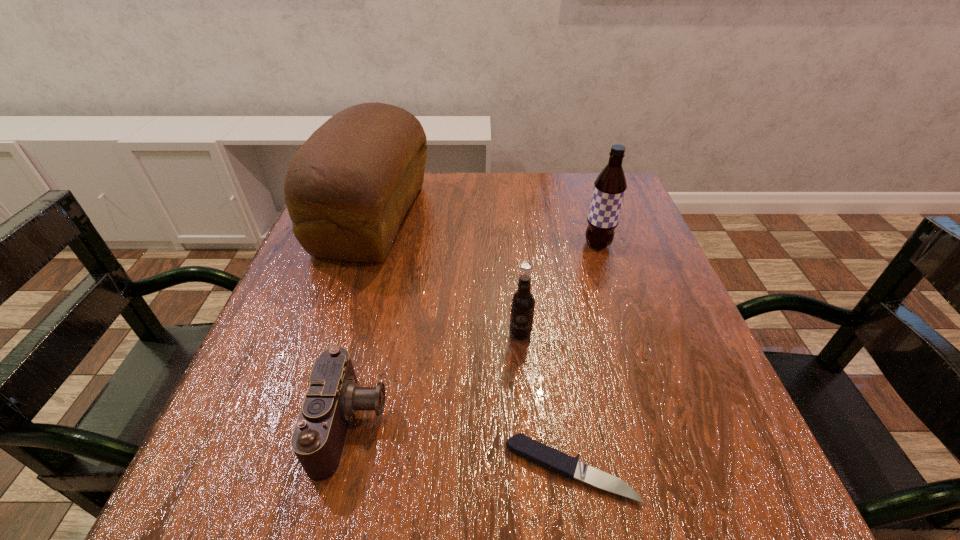
Locate an element on the screen. The height and width of the screenshot is (540, 960). vacant space at the far edge of the desktop is located at coordinates (503, 179).

You are a GUI agent. You are given a task and a screenshot of the screen. Output one action in this format:
    pyautogui.click(x=<x>, y=<y>)
    Task: Click on the free location at the left edge
    Image resolution: width=960 pixels, height=540 pixels.
    Given the screenshot: What is the action you would take?
    pyautogui.click(x=230, y=450)

The height and width of the screenshot is (540, 960). In the image, there is a desktop. In order to click on blank space at the right edge in this screenshot , I will do `click(687, 342)`.

The width and height of the screenshot is (960, 540). Find the location of `vacant space at the far right corner of the desktop`. vacant space at the far right corner of the desktop is located at coordinates (578, 209).

I want to click on vacant area at the near right corner of the desktop, so click(747, 465).

I want to click on vacant space in between the taller root beer and the steak knife, so click(584, 357).

The height and width of the screenshot is (540, 960). Identify the location of free space between the bread and the shorter root beer. (446, 275).

Identify the location of unoccupied area between the fourth tallest object and the bread. This screenshot has height=540, width=960. (362, 320).

Find the location of `free space between the shortest object and the bread`. free space between the shortest object and the bread is located at coordinates (471, 344).

Locate an element on the screen. free space between the shortest object and the right root beer is located at coordinates (584, 357).